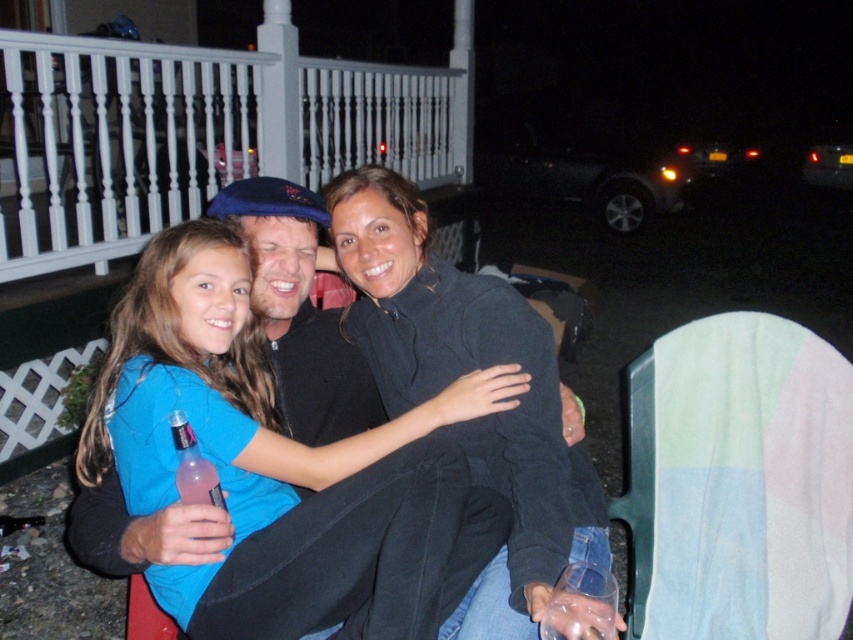
Question: Which of the following is the closest to the observer?

Choices:
 (A) dark gray sweater at center
 (B) pink translucent bottle at lower left
 (C) white painted wood railing at upper left

Answer: (B)

Question: Does white painted wood railing at upper left have a larger size compared to blue cotton shirt at center?

Choices:
 (A) yes
 (B) no

Answer: (A)

Question: Which of the following is the closest to the observer?

Choices:
 (A) blue cotton shirt at center
 (B) pink translucent bottle at lower left

Answer: (A)

Question: Observing the image, what is the correct spatial positioning of white painted wood railing at upper left in reference to blue cotton shirt at center?

Choices:
 (A) left
 (B) right

Answer: (A)

Question: Is the position of white painted wood railing at upper left less distant than that of pink translucent bottle at lower left?

Choices:
 (A) yes
 (B) no

Answer: (B)

Question: Which object is farther from the camera taking this photo?

Choices:
 (A) pink translucent bottle at lower left
 (B) white painted wood railing at upper left
 (C) dark gray sweater at center

Answer: (B)